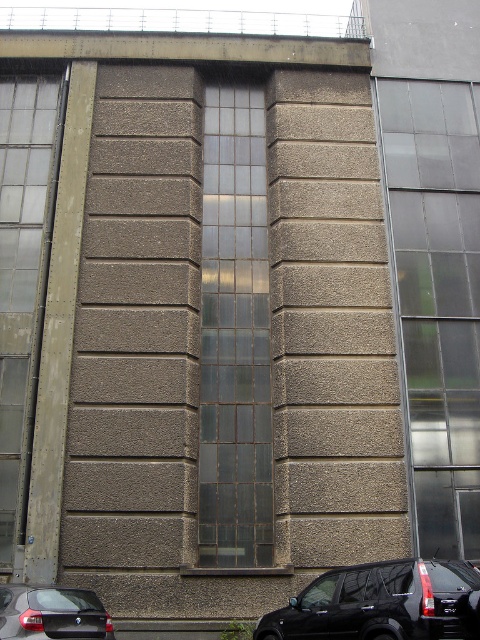
Question: Which object appears closest to the camera in this image?

Choices:
 (A) transparent glass window at center
 (B) shiny black suv at lower center
 (C) clear glass window at left
 (D) transparent glass window at right

Answer: (B)

Question: Which object appears closest to the camera in this image?

Choices:
 (A) transparent glass window at right
 (B) matte black car at lower left
 (C) transparent glass window at center
 (D) clear glass window at left

Answer: (B)

Question: Can you confirm if shiny black suv at lower center is smaller than matte black car at lower left?

Choices:
 (A) yes
 (B) no

Answer: (B)

Question: Is transparent glass window at right bigger than matte black car at lower left?

Choices:
 (A) yes
 (B) no

Answer: (A)

Question: Based on their relative distances, which object is farther from the transparent glass window at right?

Choices:
 (A) transparent glass window at center
 (B) shiny black suv at lower center
 (C) clear glass window at left

Answer: (C)

Question: Is transparent glass window at center positioned before shiny black suv at lower center?

Choices:
 (A) no
 (B) yes

Answer: (A)